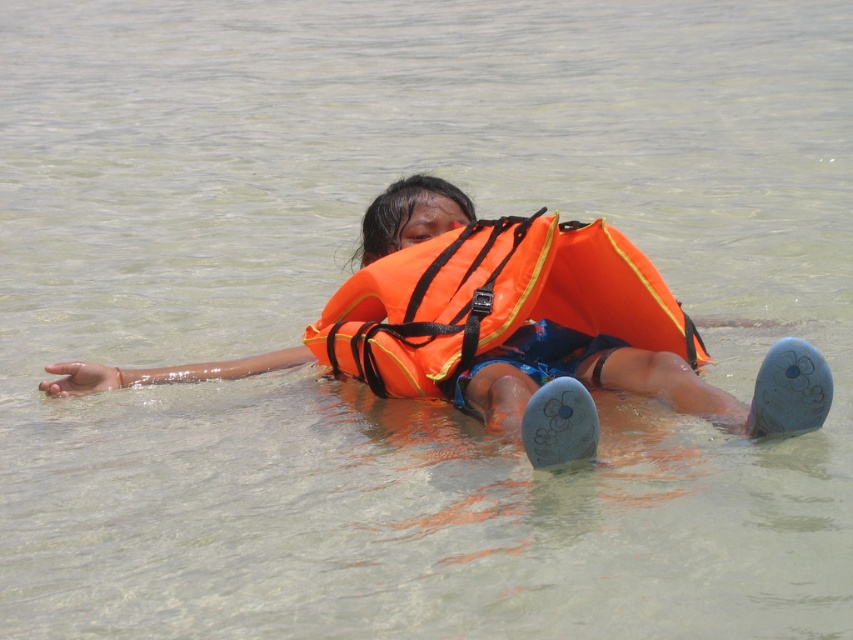
Looking at this image, you are a lifeguard on duty and need to ensure that both the orange life vest at center and the orange fabric life vest at center are properly sized for the person in the water. Which one has a greater width?

The orange life vest at center has a greater width than the orange fabric life vest at center according to the description.